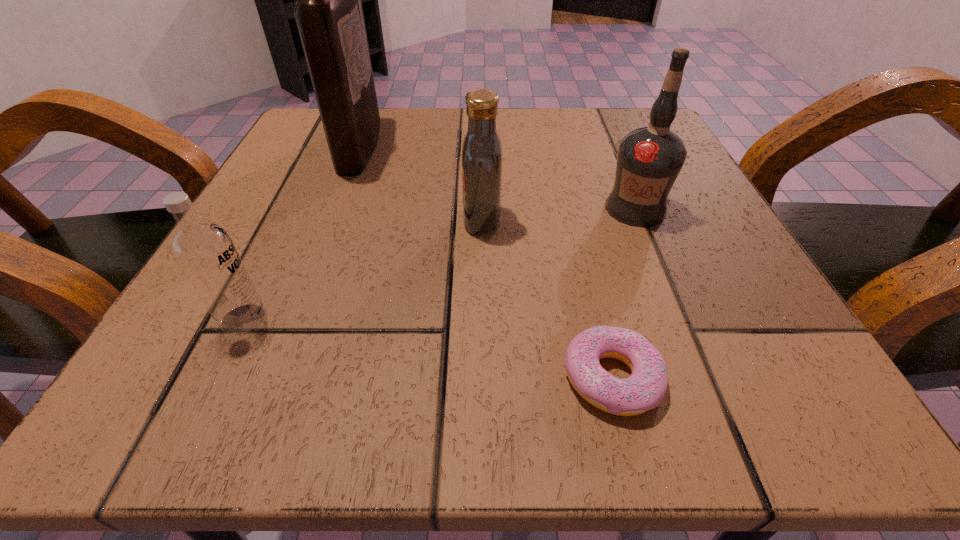
Where is `vacant space situated on the front label of the fourth shortest object`? vacant space situated on the front label of the fourth shortest object is located at coordinates (712, 395).

This screenshot has height=540, width=960. Identify the location of free space located 0.270m on the front-facing side of the third object from left to right. (287, 219).

The height and width of the screenshot is (540, 960). I want to click on vacant space located on the front-facing side of the third object from left to right, so click(424, 219).

Locate an element on the screen. This screenshot has height=540, width=960. blank space located on the front-facing side of the third object from left to right is located at coordinates (261, 219).

Locate an element on the screen. This screenshot has height=540, width=960. free space located 0.090m on the front label of the nearest vodka is located at coordinates (341, 319).

Image resolution: width=960 pixels, height=540 pixels. Identify the location of vacant space located on the left of the doughnut. (294, 378).

Where is `object at the far edge`? The image size is (960, 540). object at the far edge is located at coordinates (x=328, y=11).

Locate an element on the screen. The height and width of the screenshot is (540, 960). object that is at the near edge is located at coordinates (645, 388).

Where is `liquor that is positioned at the left edge`? liquor that is positioned at the left edge is located at coordinates (328, 11).

Identify the location of vodka located in the left edge section of the desktop. (205, 252).